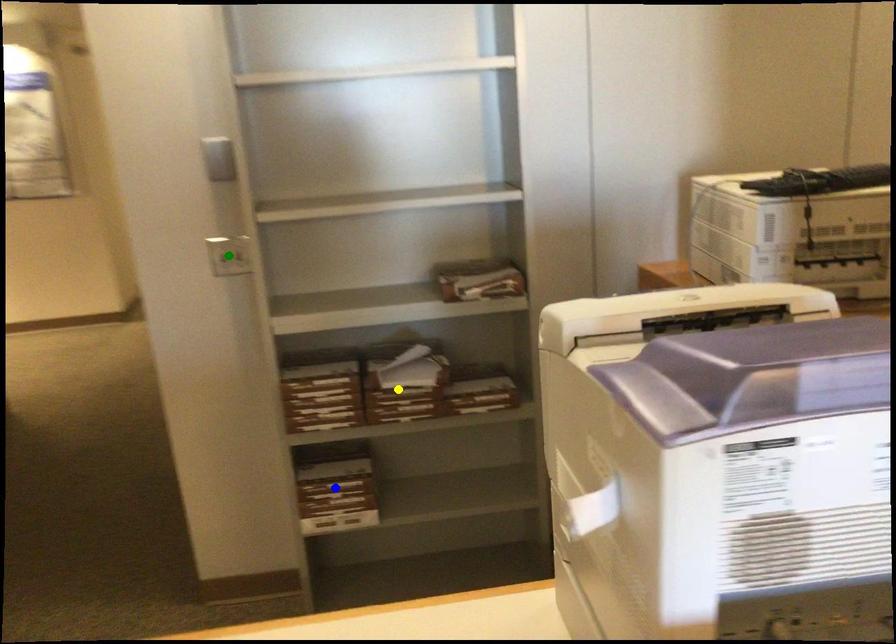
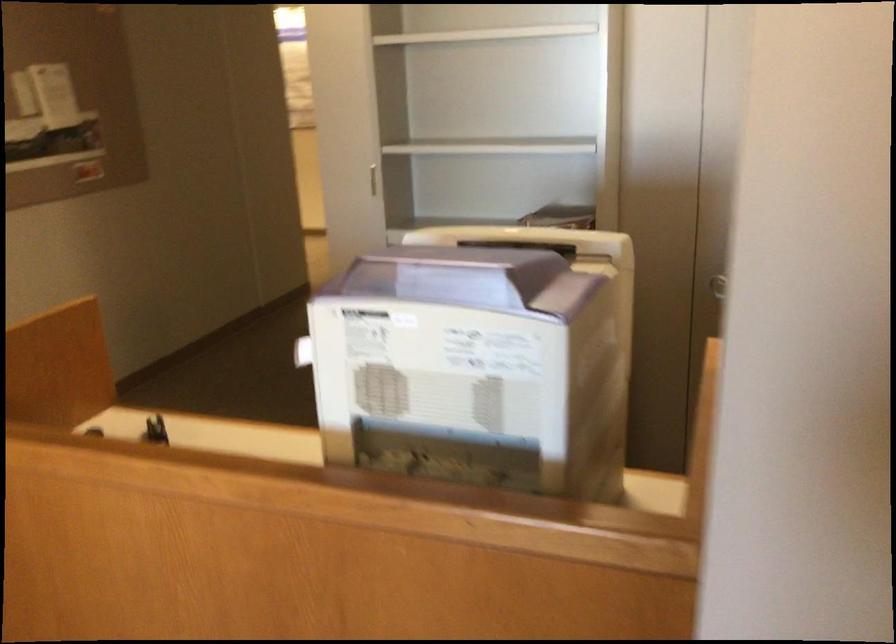
I am providing you with two images of the same scene from different viewpoints. Three points are marked in image1. Which point corresponds to a part or object that is occluded in image2?In image1, three points are marked. Which of them correspond to a part or object that is occluded in image2?Among the three points shown in image1, which one corresponds to a part or object that is no longer visible due to occlusion in image2?

green point, blue point, yellow point